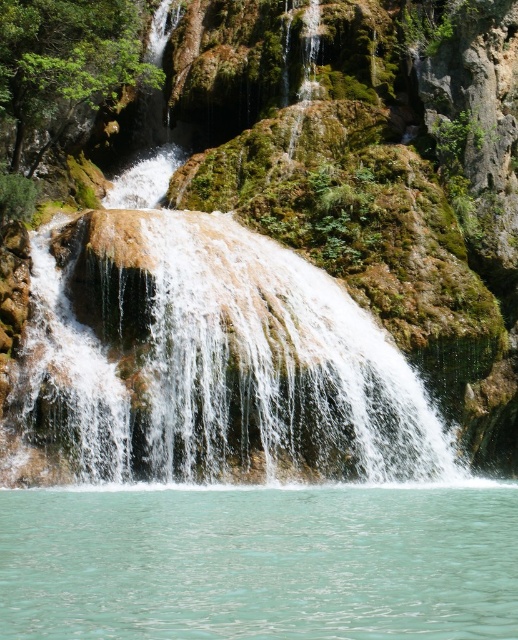
Can you confirm if green mossy rock at center is positioned to the right of turquoise liquid at bottom?

In fact, green mossy rock at center is to the left of turquoise liquid at bottom.

Between green mossy rock at center and turquoise liquid at bottom, which one appears on the right side from the viewer's perspective?

turquoise liquid at bottom

I want to click on green mossy rock at center, so click(226, 365).